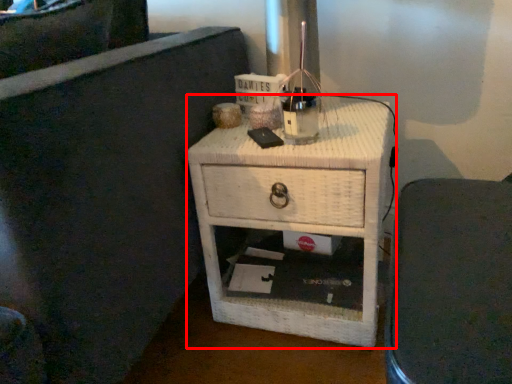
Question: From the image's perspective, considering the relative positions of nightstand (annotated by the red box) and furniture in the image provided, where is nightstand (annotated by the red box) located with respect to the staircase?

Choices:
 (A) above
 (B) below

Answer: (A)